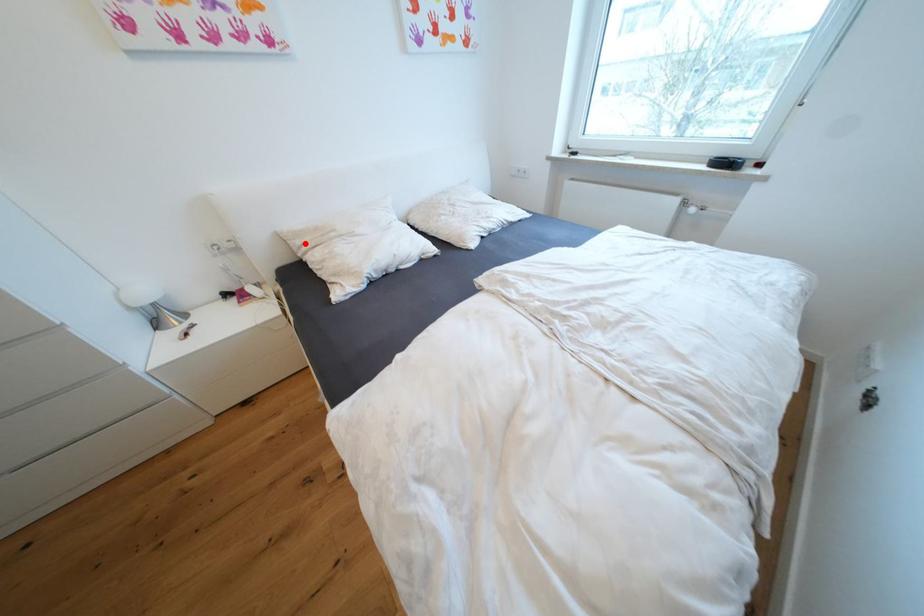
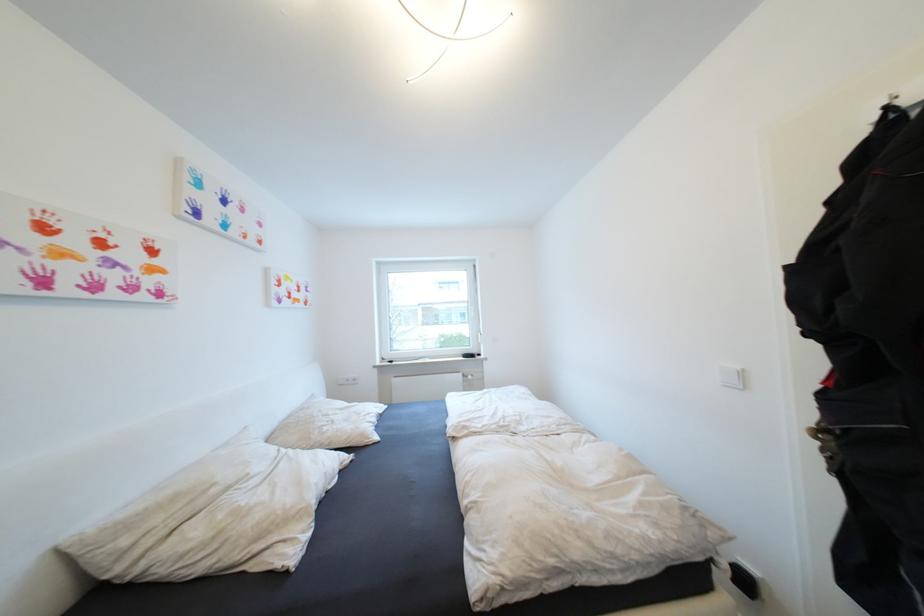
Question: I am providing you with two images of the same scene from different viewpoints. In image1, a red point is highlighted. Considering the same 3D point in image2, which of the following is correct?

Choices:
 (A) It is closer
 (B) It is farther

Answer: (A)